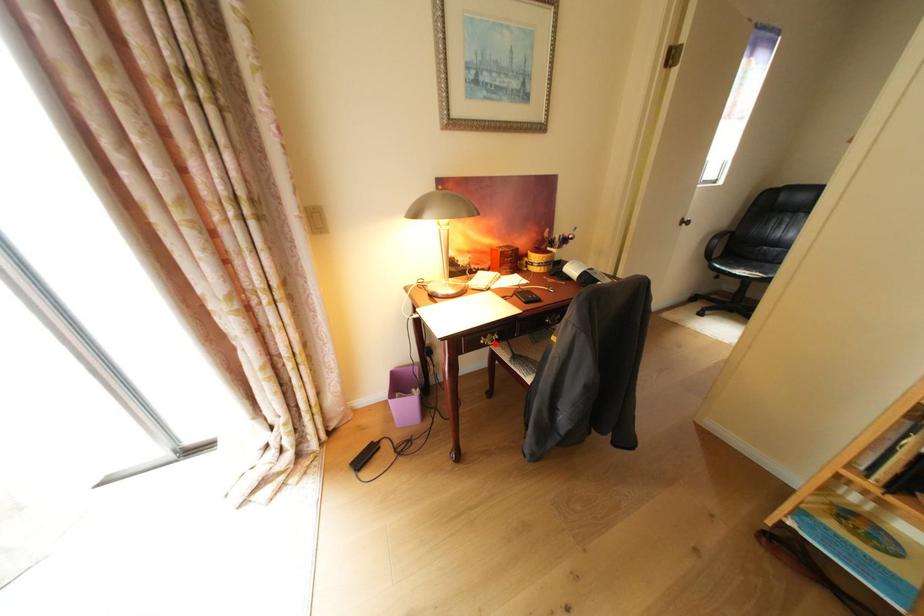
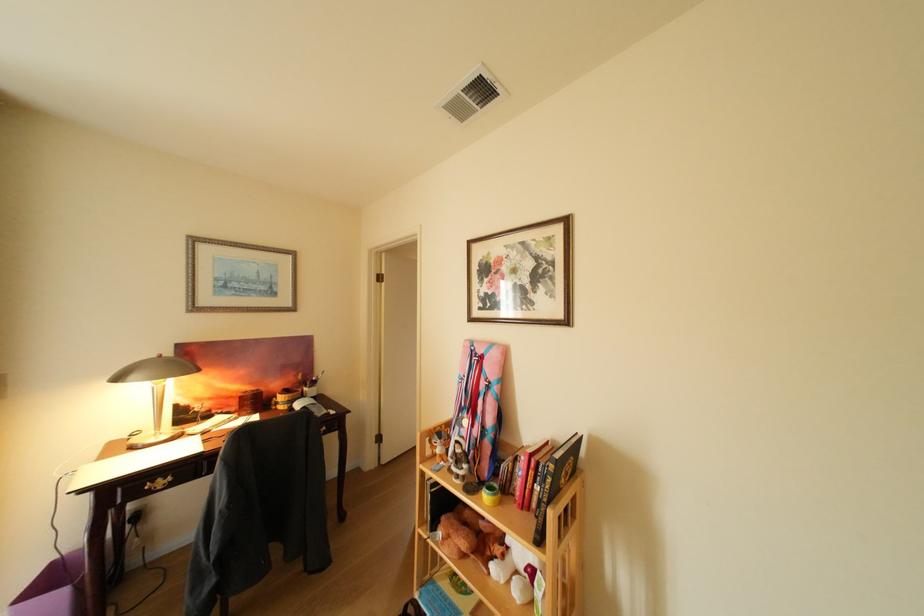
Where in the second image is the point corresponding to the highlighted location from the first image?

(160, 490)